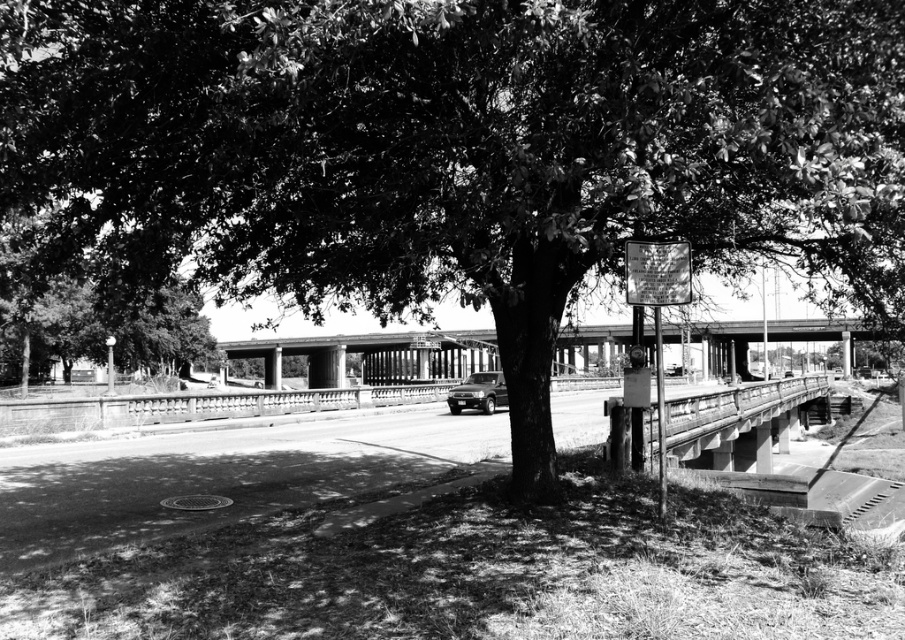
Question: Is green leafy tree at left further to camera compared to concrete bridge at center?

Choices:
 (A) yes
 (B) no

Answer: (B)

Question: Which of the following is the closest to the observer?

Choices:
 (A) (563, 364)
 (B) (132, 323)

Answer: (B)

Question: Does green leafy tree at left appear under concrete bridge at center?

Choices:
 (A) no
 (B) yes

Answer: (A)

Question: Is green leafy tree at left to the right of concrete bridge at center from the viewer's perspective?

Choices:
 (A) no
 (B) yes

Answer: (A)

Question: Which point is farther to the camera?

Choices:
 (A) green leafy tree at left
 (B) concrete bridge at center

Answer: (B)

Question: Which object is closer to the camera taking this photo?

Choices:
 (A) concrete bridge at center
 (B) green leafy tree at left

Answer: (B)